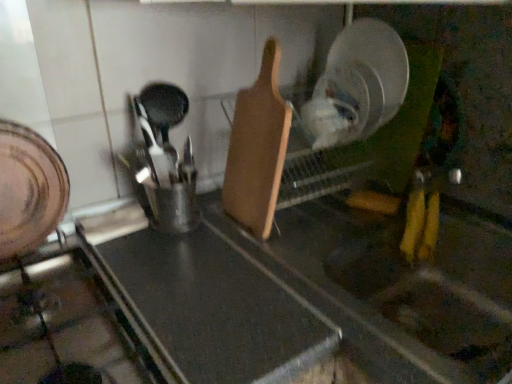
Question: Is black matte cutting board at center further to the viewer compared to wooden cutting board at center?

Choices:
 (A) no
 (B) yes

Answer: (A)

Question: From a real-world perspective, does black matte cutting board at center sit lower than wooden cutting board at center?

Choices:
 (A) no
 (B) yes

Answer: (B)

Question: Is black matte cutting board at center oriented away from wooden cutting board at center?

Choices:
 (A) no
 (B) yes

Answer: (A)

Question: From the image's perspective, would you say black matte cutting board at center is shown under wooden cutting board at center?

Choices:
 (A) yes
 (B) no

Answer: (A)

Question: Is black matte cutting board at center aimed at wooden cutting board at center?

Choices:
 (A) no
 (B) yes

Answer: (A)

Question: Considering the relative positions of black matte cutting board at center and wooden cutting board at center in the image provided, is black matte cutting board at center to the left of wooden cutting board at center from the viewer's perspective?

Choices:
 (A) yes
 (B) no

Answer: (A)

Question: From a real-world perspective, is wooden cutting board at center located beneath brushed metal gas stove at lower left?

Choices:
 (A) yes
 (B) no

Answer: (B)

Question: Considering the relative sizes of wooden cutting board at center and brushed metal gas stove at lower left in the image provided, is wooden cutting board at center taller than brushed metal gas stove at lower left?

Choices:
 (A) yes
 (B) no

Answer: (A)

Question: Is wooden cutting board at center oriented away from brushed metal gas stove at lower left?

Choices:
 (A) no
 (B) yes

Answer: (A)

Question: From a real-world perspective, is wooden cutting board at center on brushed metal gas stove at lower left?

Choices:
 (A) yes
 (B) no

Answer: (A)

Question: Does wooden cutting board at center have a lesser height compared to brushed metal gas stove at lower left?

Choices:
 (A) yes
 (B) no

Answer: (B)

Question: Is wooden cutting board at center wider than brushed metal gas stove at lower left?

Choices:
 (A) yes
 (B) no

Answer: (B)

Question: Can you confirm if brushed metal gas stove at lower left is wider than black matte cutting board at center?

Choices:
 (A) no
 (B) yes

Answer: (A)